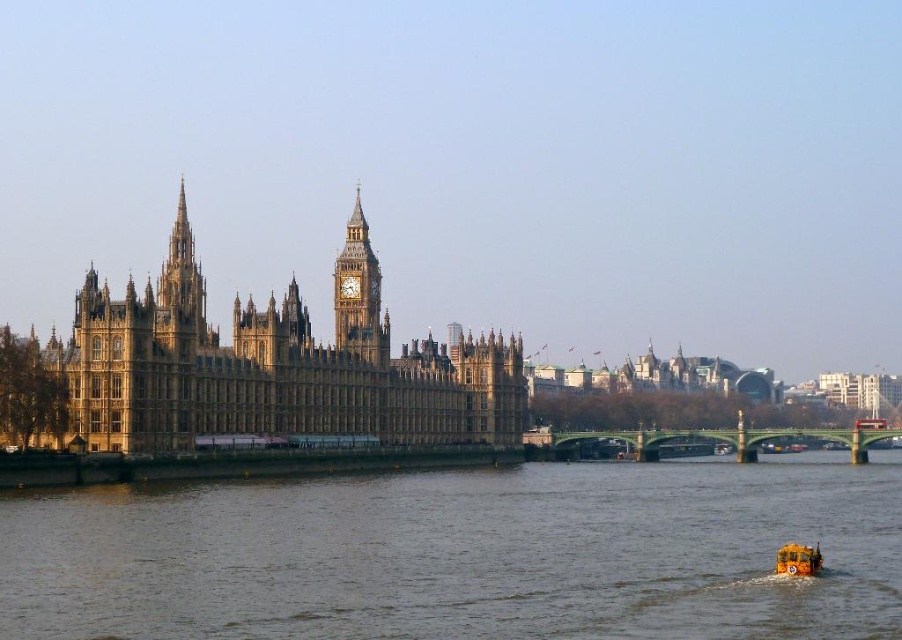
Between point (871, 604) and point (170, 259), which one is positioned behind?

Point (170, 259)

This screenshot has width=902, height=640. Find the location of `brown stone water at lower center`. brown stone water at lower center is located at coordinates (465, 556).

Is brown stone water at lower center wider than yellow rubber boat at lower right?

Correct, the width of brown stone water at lower center exceeds that of yellow rubber boat at lower right.

Is brown stone water at lower center above yellow rubber boat at lower right?

No, brown stone water at lower center is not above yellow rubber boat at lower right.

The width and height of the screenshot is (902, 640). I want to click on brown stone water at lower center, so [x=465, y=556].

Consider the image. Does golden stone clock tower at center have a lesser height compared to yellow rubber boat at lower right?

No.

Is point (376, 262) in front of point (813, 552)?

No, (376, 262) is further to viewer.

Find the location of a particular element. golden stone clock tower at center is located at coordinates click(x=359, y=294).

This screenshot has height=640, width=902. Find the location of `golden stone clock tower at center`. golden stone clock tower at center is located at coordinates (359, 294).